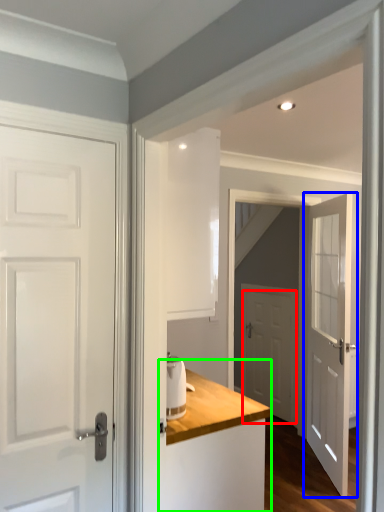
Question: Which object is the farthest from door (highlighted by a red box)? Choose among these: door (highlighted by a blue box) or dresser (highlighted by a green box).

Choices:
 (A) door
 (B) dresser

Answer: (B)